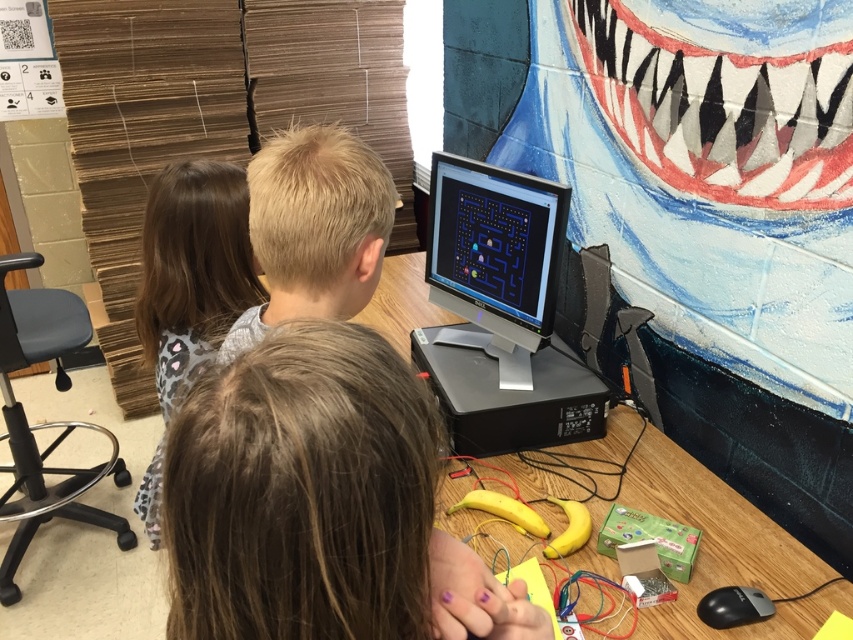
You are a photographer standing in front of the scene. You want to take a photo of the blonde hair at center. Where should you aim your camera to capture it?

You should aim your camera at the point with coordinates 0.358 on the x axis and 0.369 on the y axis to capture the blonde hair at center.